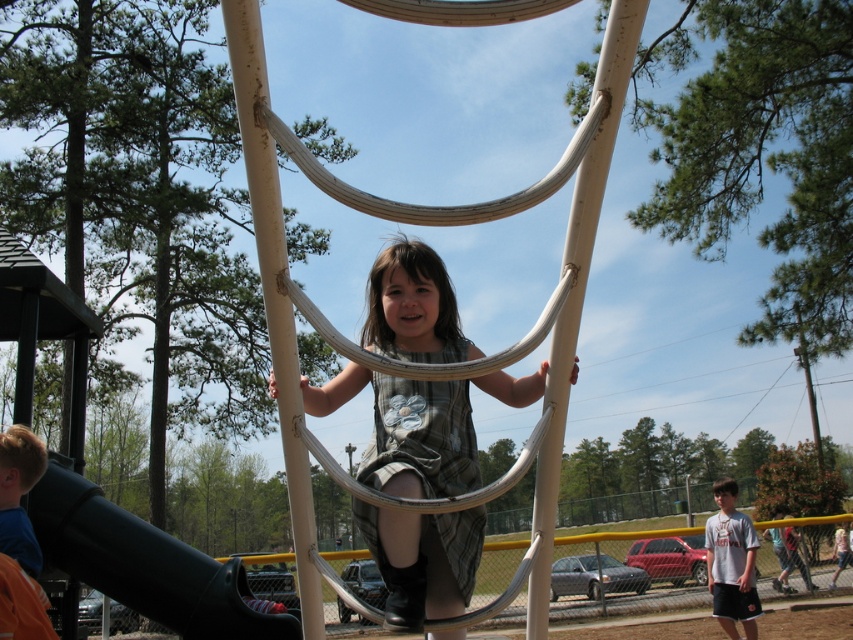
In the scene shown: Does matte gray dress at center have a greater width compared to black rubber slide at lower left?

Incorrect, matte gray dress at center's width does not surpass black rubber slide at lower left's.

Is matte gray dress at center shorter than black rubber slide at lower left?

Correct, matte gray dress at center is not as tall as black rubber slide at lower left.

Does point (318, 397) come in front of point (64, 492)?

That is True.

Image resolution: width=853 pixels, height=640 pixels. What are the coordinates of `matte gray dress at center` in the screenshot? It's located at (407, 432).